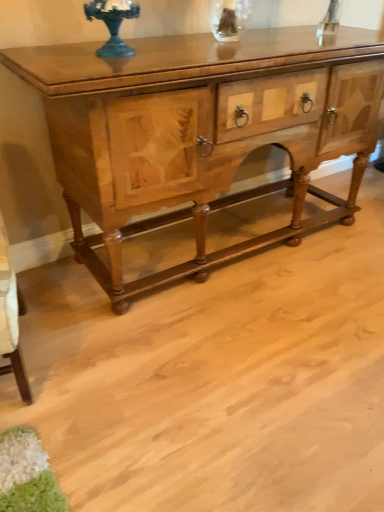
Locate an element on the screen. free point above wooden cabinet at center (from a real-world perspective) is located at coordinates (210, 44).